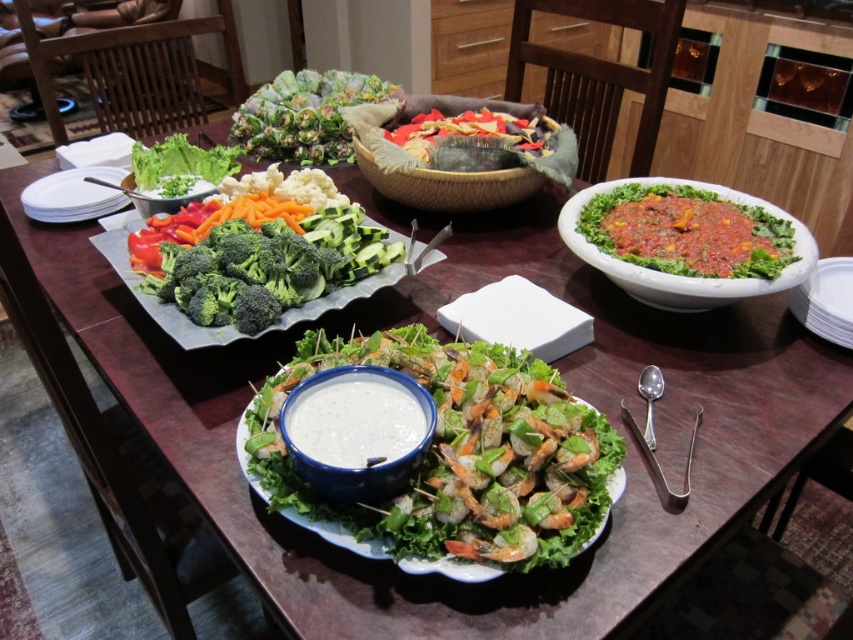
Question: Which point is closer to the camera taking this photo?

Choices:
 (A) (831, 268)
 (B) (393, 92)
 (C) (686, 280)
 (D) (212, 189)

Answer: (C)

Question: Estimate the real-world distances between objects in this image. Which object is farther from the green leafy salad at right?

Choices:
 (A) green leafy lettuce at upper left
 (B) green leafy salad at upper left
 (C) green fresh broccoli at center
 (D) green leafymaterial/texturesalad at center

Answer: (A)

Question: Is green leafy salad at right above bamboo basket salad at center?

Choices:
 (A) yes
 (B) no

Answer: (B)

Question: Observing the image, what is the correct spatial positioning of white matte bowl at center in reference to white paper plates at left?

Choices:
 (A) below
 (B) above

Answer: (A)

Question: Does green fresh broccoli at center have a smaller size compared to green leafy salad at upper left?

Choices:
 (A) no
 (B) yes

Answer: (A)

Question: Which object is the closest to the white matte bowl at center?

Choices:
 (A) green leafymaterial/texturevegetable at upper center
 (B) green leafy lettuce at upper left
 (C) green leafy salad at upper left

Answer: (C)